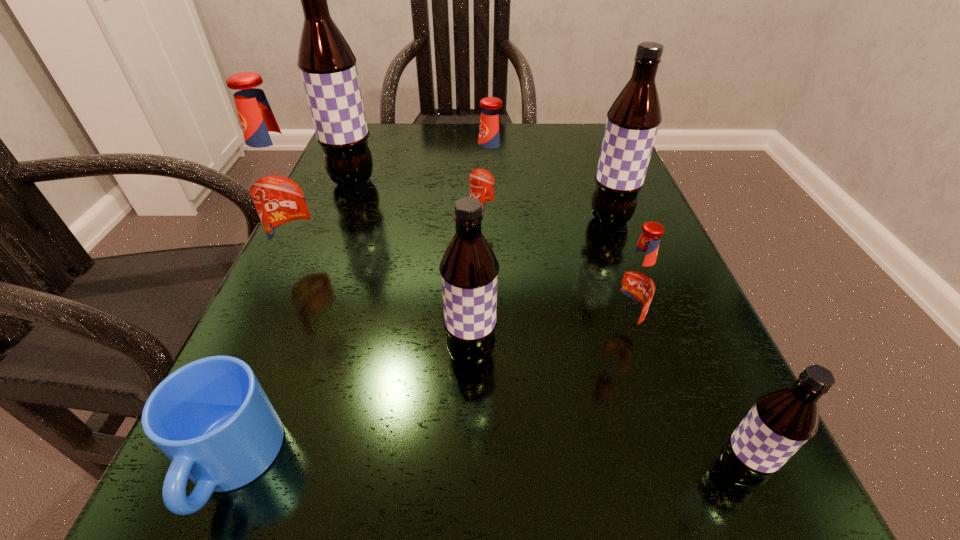
Locate an element on the screen. vacant area that lies between the shortest object and the third smallest brown root beer is located at coordinates (420, 341).

Select which object appears as the closest to the mug. Please provide its 2D coordinates. Your answer should be formatted as a tuple, i.e. [(x, y)], where the tuple contains the x and y coordinates of a point satisfying the conditions above.

[(469, 269)]

Find the location of a particular element. object that stands as the seventh closest to the third biggest brown root beer is located at coordinates (327, 65).

Select which root beer is the sixth closest to the second nearest brown root beer. Please provide its 2D coordinates. Your answer should be formatted as a tuple, i.e. [(x, y)], where the tuple contains the x and y coordinates of a point satisfying the conditions above.

[(327, 65)]

The height and width of the screenshot is (540, 960). I want to click on root beer that is the second closest to the biggest brown root beer, so click(x=490, y=173).

Identify which brown root beer is the closest to the smallest red root beer. Please provide its 2D coordinates. Your answer should be formatted as a tuple, i.e. [(x, y)], where the tuple contains the x and y coordinates of a point satisfying the conditions above.

[(469, 269)]

Locate which brown root beer is the third closest to the second smallest brown root beer. Please provide its 2D coordinates. Your answer should be formatted as a tuple, i.e. [(x, y)], where the tuple contains the x and y coordinates of a point satisfying the conditions above.

[(327, 65)]

Identify which red root beer is the third closest to the second smallest brown root beer. Please provide its 2D coordinates. Your answer should be formatted as a tuple, i.e. [(x, y)], where the tuple contains the x and y coordinates of a point satisfying the conditions above.

[(280, 188)]

The image size is (960, 540). Identify the location of red root beer that stands as the second closest to the second farthest brown root beer. (635, 285).

This screenshot has width=960, height=540. What are the coordinates of `vacant region that satisfies the following two spatial constraints: 1. on the side of the mug with the handle; 2. on the right side of the nearest brown root beer` in the screenshot? It's located at (228, 472).